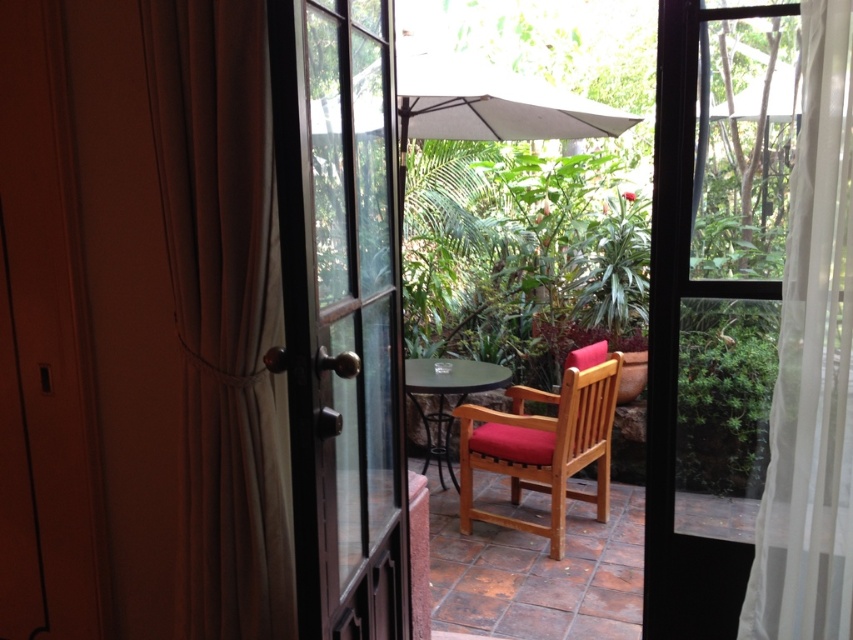
Question: Does black glass door at center appear over matte black table at center?

Choices:
 (A) yes
 (B) no

Answer: (A)

Question: Among these points, which one is nearest to the camera?

Choices:
 (A) click(612, 400)
 (B) click(322, 115)

Answer: (B)

Question: Which object is positioned closest to the brown fabric curtain at left?

Choices:
 (A) teak wood armchair at center
 (B) black glass door at center
 (C) matte black table at center

Answer: (B)

Question: Which point is farther to the camera?

Choices:
 (A) (819, 196)
 (B) (495, 387)
 (C) (180, 564)

Answer: (B)

Question: Is teak wood armchair at center above white matte umbrella at upper center?

Choices:
 (A) yes
 (B) no

Answer: (B)

Question: Can you confirm if white sheer curtain at right is positioned to the left of teak wood armchair at center?

Choices:
 (A) no
 (B) yes

Answer: (A)